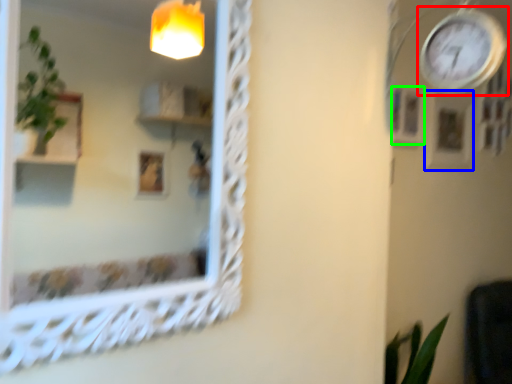
Question: Which is farther away from clock (highlighted by a red box)? picture frame (highlighted by a blue box) or picture frame (highlighted by a green box)?

Choices:
 (A) picture frame
 (B) picture frame

Answer: (A)